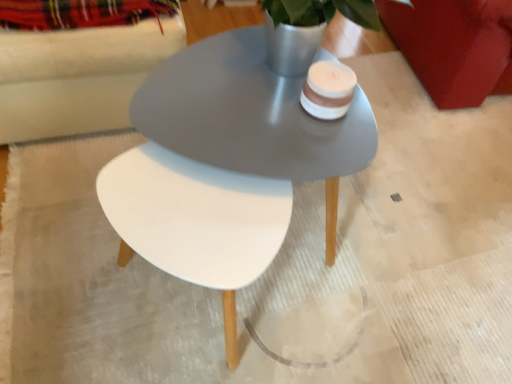
Image resolution: width=512 pixels, height=384 pixels. Find the location of `matte red couch at upper right`. matte red couch at upper right is located at coordinates (454, 47).

The image size is (512, 384). What do you see at coordinates (454, 47) in the screenshot?
I see `matte red couch at upper right` at bounding box center [454, 47].

The image size is (512, 384). I want to click on matte red couch at upper right, so click(454, 47).